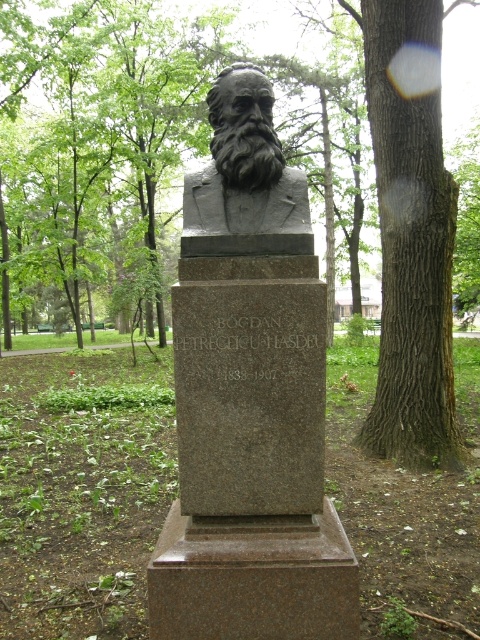
You are a park maintenance worker who needs to clean the area around the black stone bust at center. You have a 3.5 meter long hose attached to a water source. Can you reach the brown textured bark at center with the hose without moving the hose attachment point?

The distance between the brown textured bark at center and the black stone bust at center is 3.77 meters. Since the hose is only 3.5 meters long, it is not long enough to reach the brown textured bark at center from the black stone bust at center without moving the hose attachment point.

You are a visitor standing in front of the monument of Bogdan Petriceicu Hasdeu. You notice two points marked on the pedestal. One is at coordinate point (58, 132) and the other at point (418, 212). Which point is closer to you?

Point (58, 132) is closer to you because it is further to the viewer than point (418, 212).